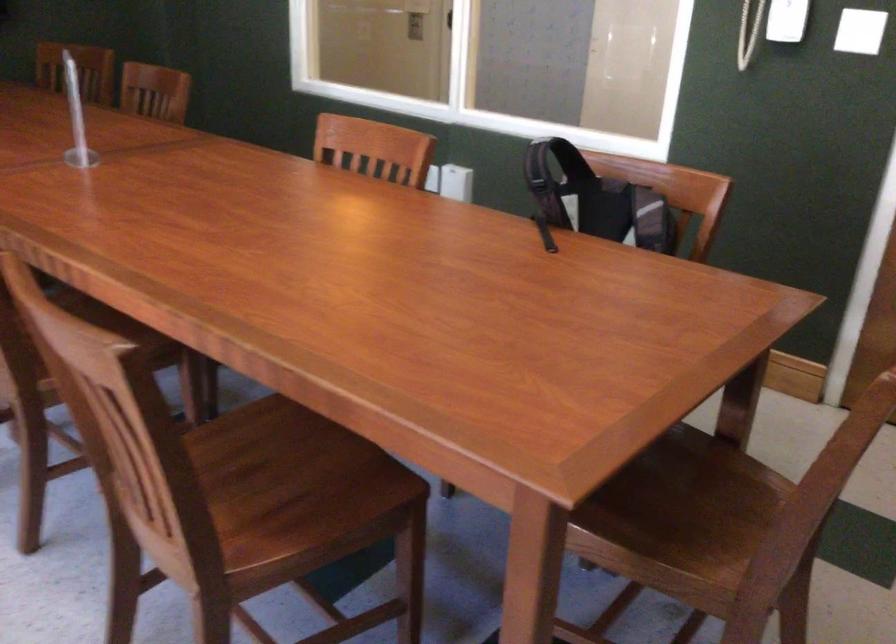
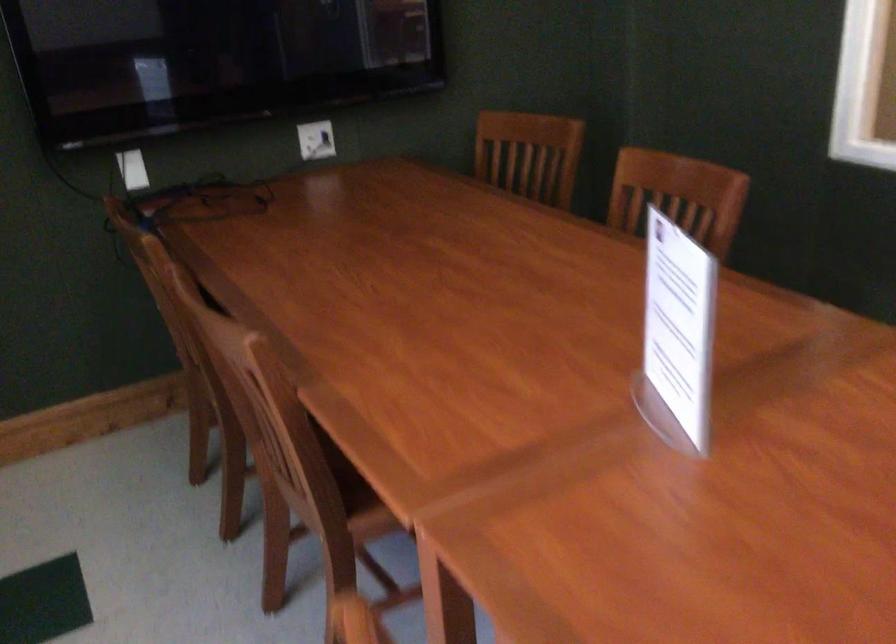
In the second image, find the point that corresponds to [159,89] in the first image.

(677, 196)